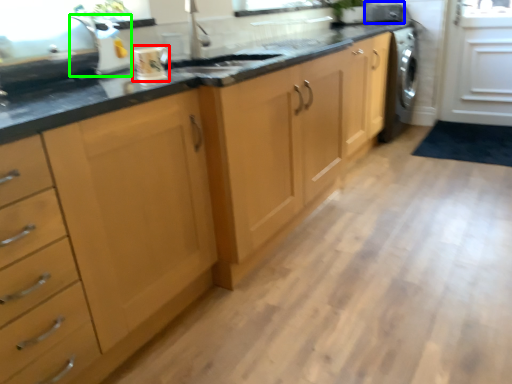
Question: Estimate the real-world distances between objects in this image. Which object is farther from kitchen appliance (highlighted by a red box), appliance (highlighted by a blue box) or appliance (highlighted by a green box)?

Choices:
 (A) appliance
 (B) appliance

Answer: (A)